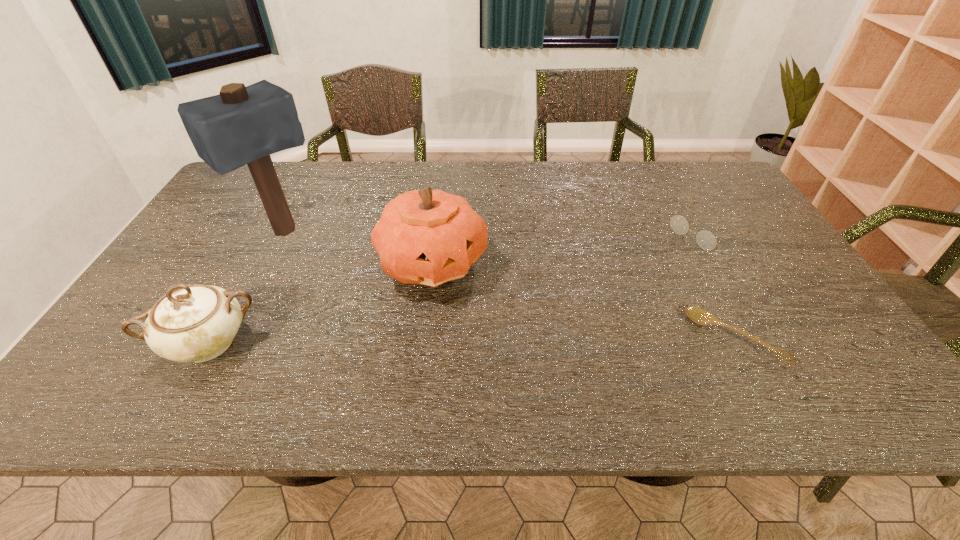
Image resolution: width=960 pixels, height=540 pixels. In order to click on vacant space located 0.070m on the temples of the fourth tallest object in this screenshot , I will do `click(666, 255)`.

Locate an element on the screen. The height and width of the screenshot is (540, 960). free space located on the striking surface of the tallest object is located at coordinates 322,266.

The image size is (960, 540). I want to click on free space located 0.370m on the striking surface of the tallest object, so click(387, 325).

Locate an element on the screen. free space located 0.320m on the striking surface of the tallest object is located at coordinates (374, 314).

This screenshot has width=960, height=540. In order to click on vacant area located 0.290m on the front-facing side of the fourth shortest object in this screenshot , I will do `click(560, 359)`.

Find the location of a particular element. This screenshot has width=960, height=540. vacant space located on the front-facing side of the fourth shortest object is located at coordinates (487, 303).

Identify the location of blank area located on the front-facing side of the fourth shortest object. [501, 314].

Image resolution: width=960 pixels, height=540 pixels. I want to click on chinaware situated at the near edge, so point(195,323).

You are a GUI agent. You are given a task and a screenshot of the screen. Output one action in this format:
    pyautogui.click(x=<x>, y=<y>)
    Task: Click on the ladle present at the near edge
    
    Given the screenshot: What is the action you would take?
    pyautogui.click(x=698, y=315)

Find the location of `chinaware that is at the left edge`. chinaware that is at the left edge is located at coordinates (195, 323).